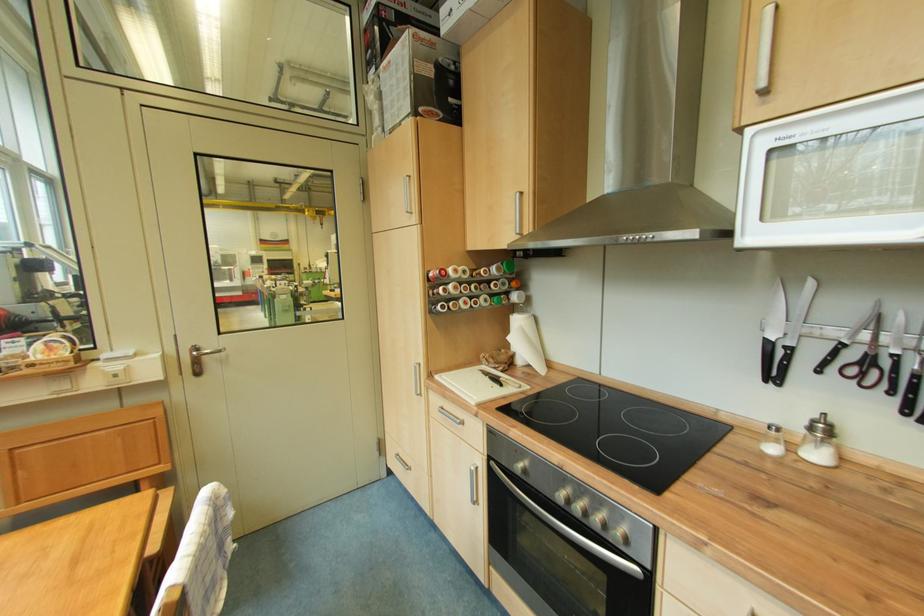
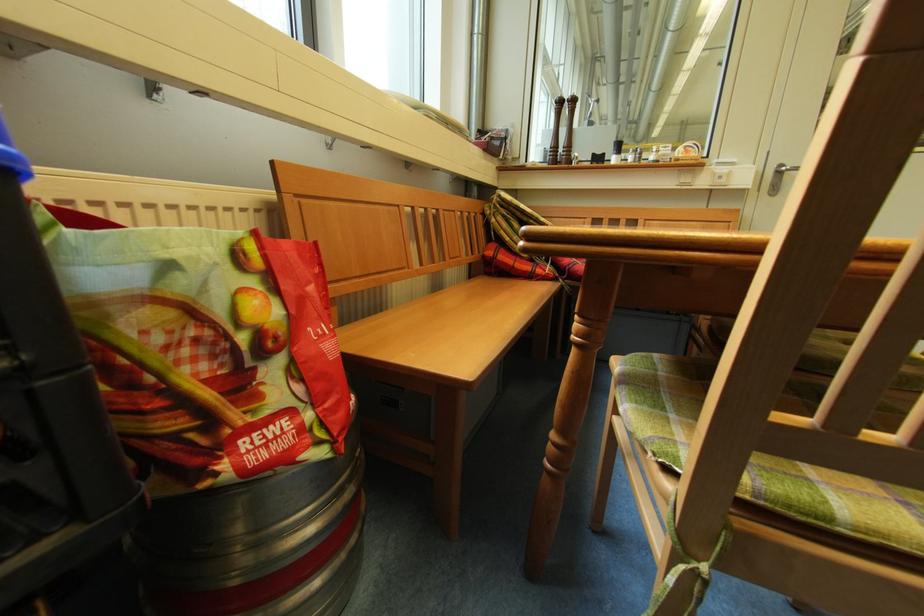
The point at (208, 347) is marked in the first image. Where is the corresponding point in the second image?

(795, 167)